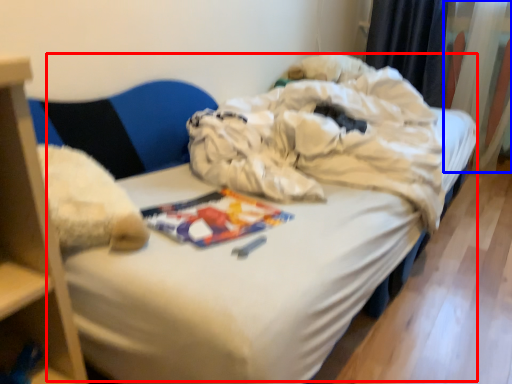
Question: Which point is further to the camera, bed (highlighted by a red box) or curtain (highlighted by a blue box)?

Choices:
 (A) bed
 (B) curtain

Answer: (B)